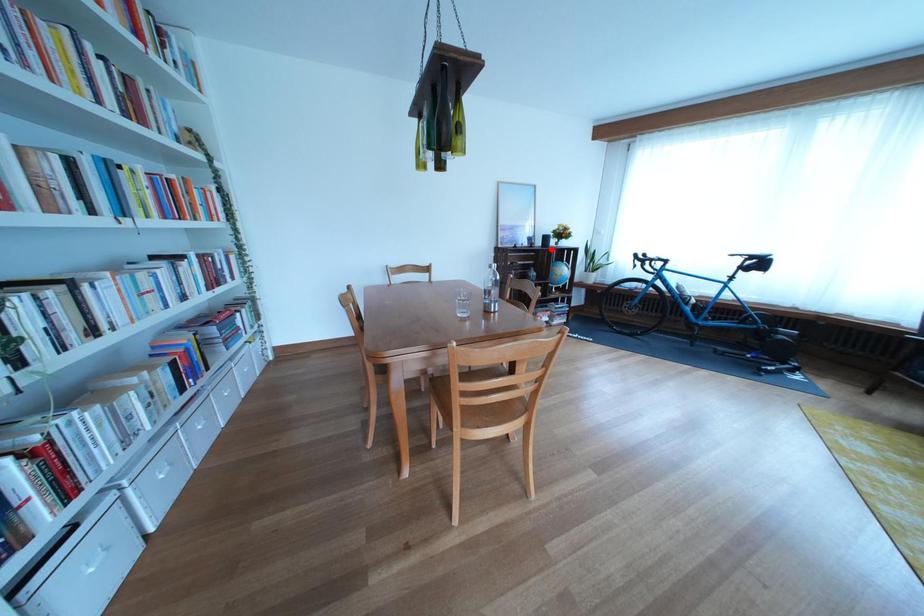
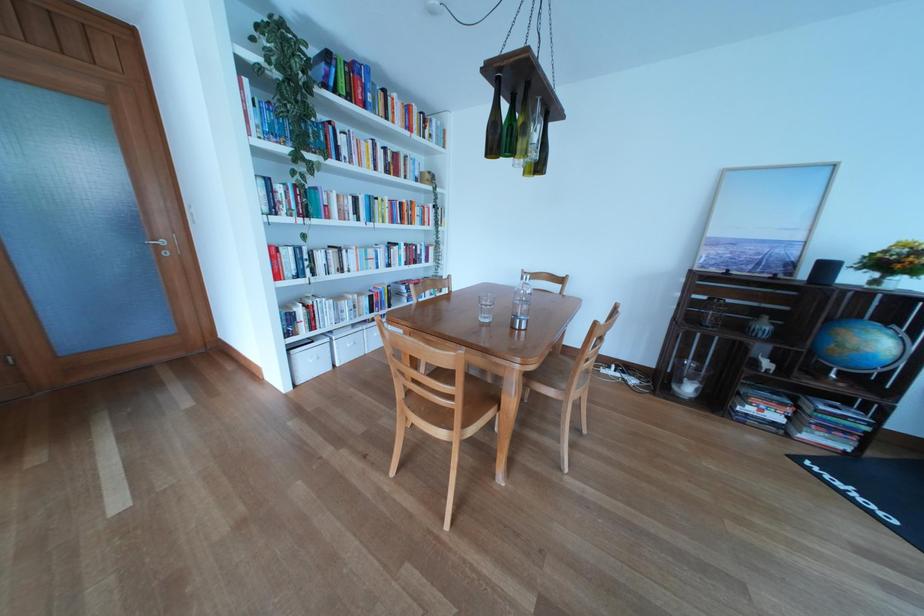
Find the pixel in the second image that matches the highlighted location in the first image.

(816, 282)